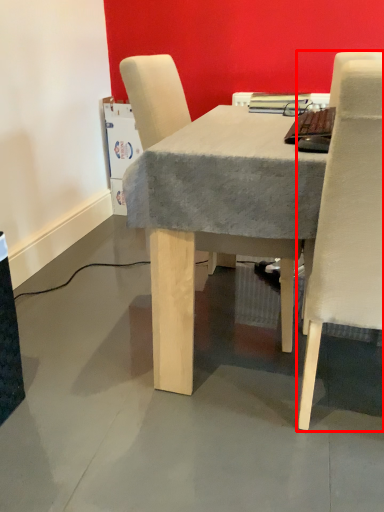
Question: In this image, where is chair (annotated by the red box) located relative to chair?

Choices:
 (A) right
 (B) left

Answer: (A)